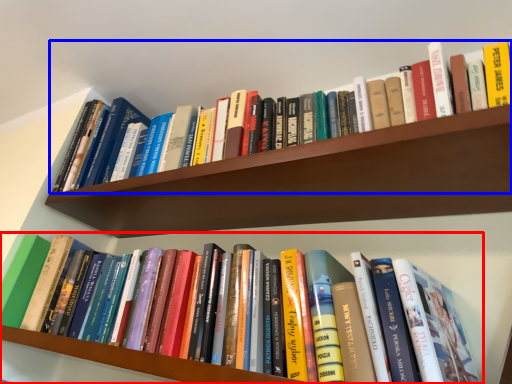
Question: Which of the following is the closest to the observer, book (highlighted by a red box) or book (highlighted by a blue box)?

Choices:
 (A) book
 (B) book

Answer: (A)